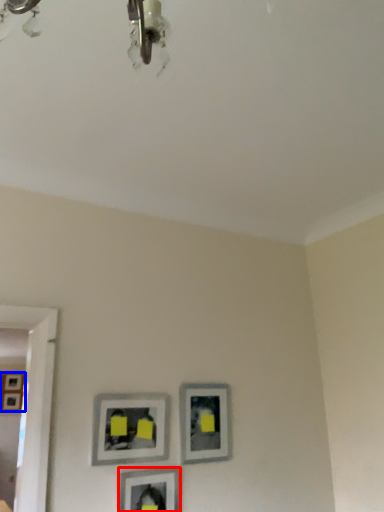
Question: Which point is further to the camera, picture frame (highlighted by a red box) or picture frame (highlighted by a blue box)?

Choices:
 (A) picture frame
 (B) picture frame

Answer: (B)